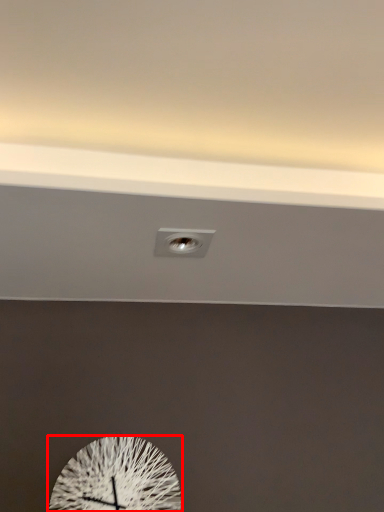
Question: From the image's perspective, considering the relative positions of wall clock (annotated by the red box) and electric outlet in the image provided, where is wall clock (annotated by the red box) located with respect to the staircase?

Choices:
 (A) above
 (B) below

Answer: (B)